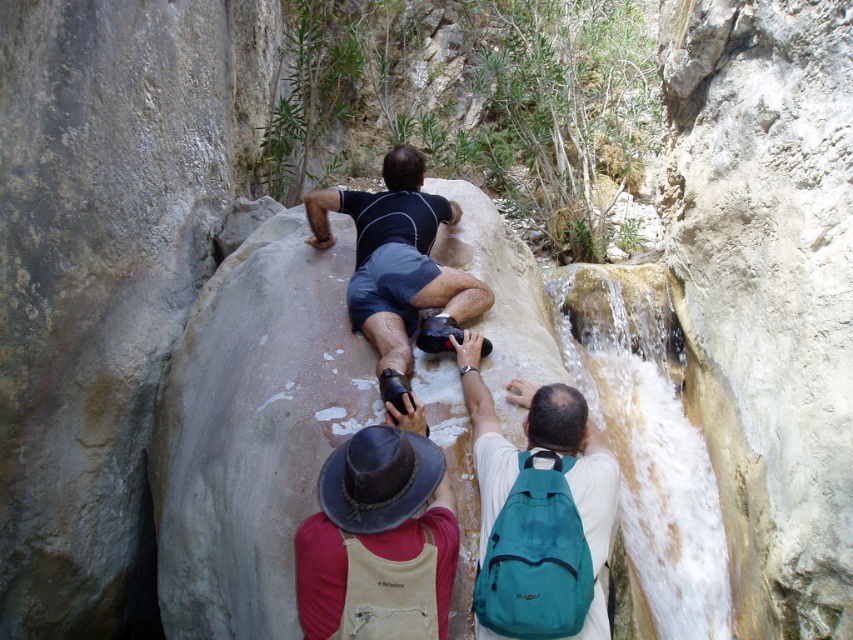
Can you confirm if clear water at waterfall right is wider than brown leather hat at upper center?

In fact, clear water at waterfall right might be narrower than brown leather hat at upper center.

Which is in front, point (706, 592) or point (363, 476)?

Point (363, 476) is more forward.

The image size is (853, 640). What are the coordinates of `clear water at waterfall right` in the screenshot? It's located at (647, 438).

What are the coordinates of `teal fabric backpack at center` in the screenshot? It's located at (538, 512).

Is point (575, 582) closer to viewer compared to point (320, 616)?

No.

Who is more distant from viewer, (503, 454) or (439, 576)?

Positioned behind is point (503, 454).

Identify the location of teal fabric backpack at center. (538, 512).

Is clear water at waterfall right smaller than teal fabric backpack at center?

Correct, clear water at waterfall right occupies less space than teal fabric backpack at center.

Is point (579, 326) positioned after point (526, 524)?

Yes, it is.

Is point (634, 294) less distant than point (572, 520)?

That is False.

Locate an element on the screen. clear water at waterfall right is located at coordinates (647, 438).